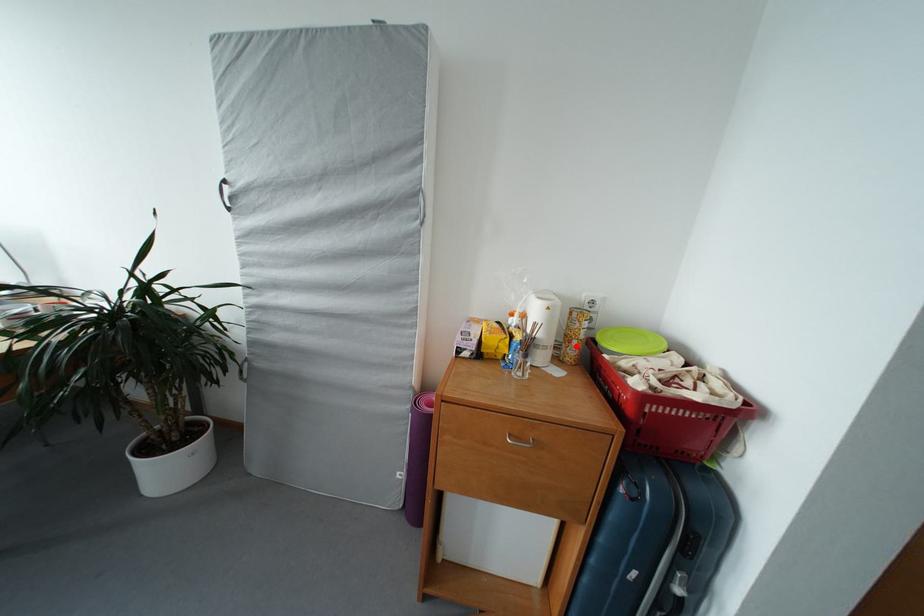
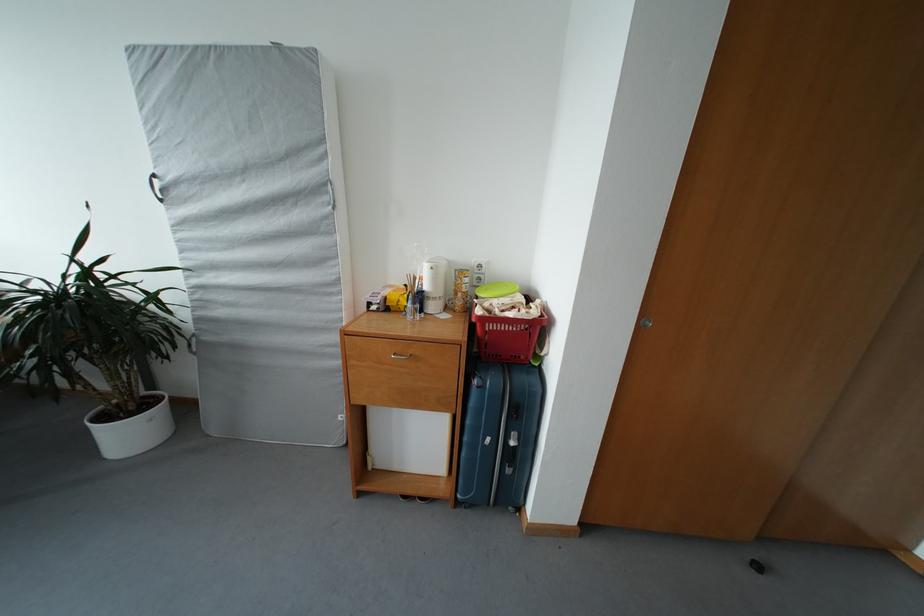
The point at the highlighted location is marked in the first image. Where is the corresponding point in the second image?

(463, 300)